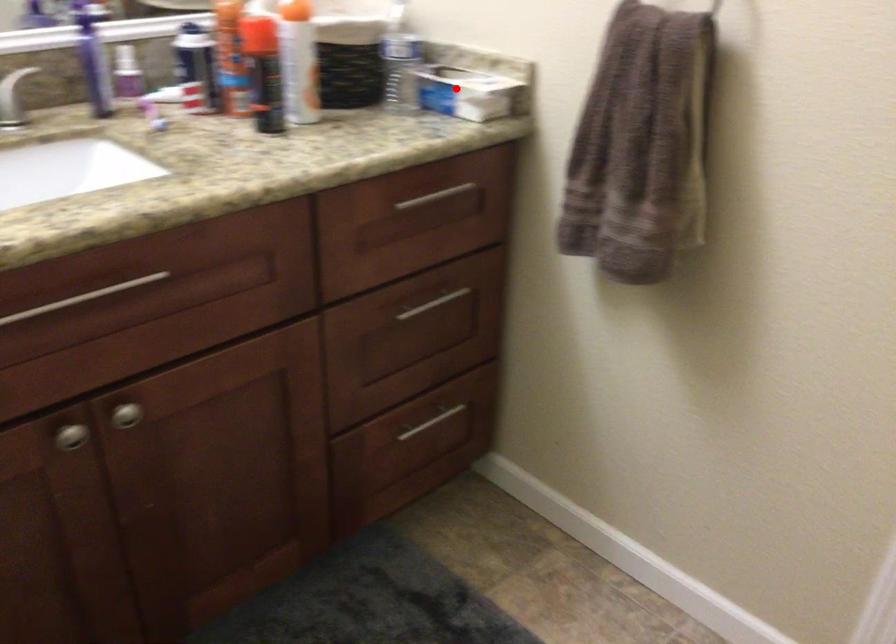
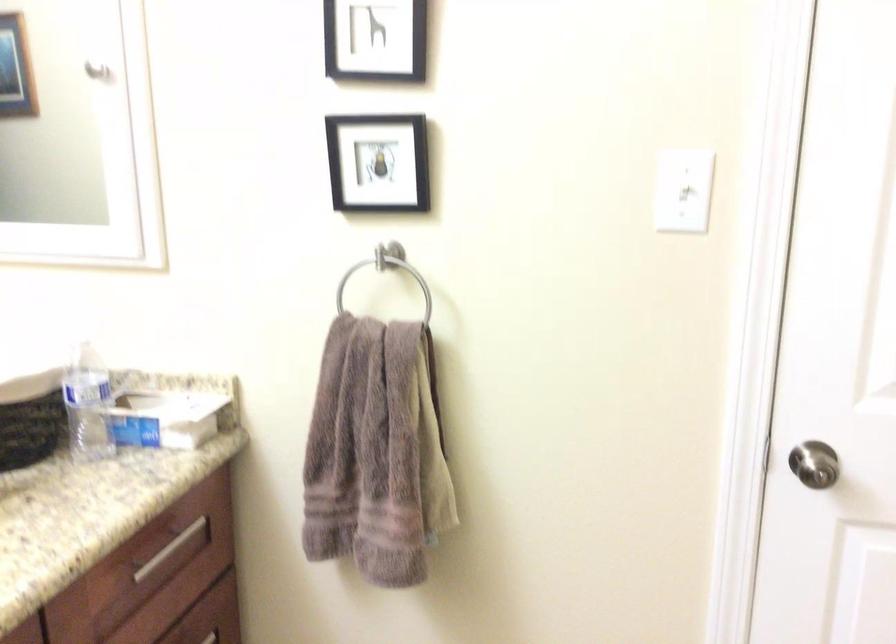
Where in the second image is the point corresponding to the highlighted location from the first image?

(165, 418)